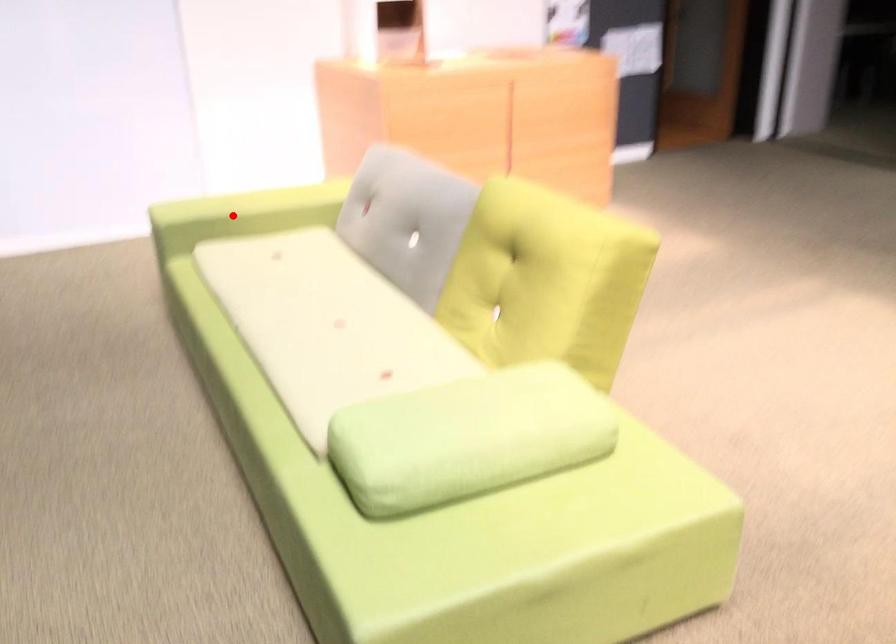
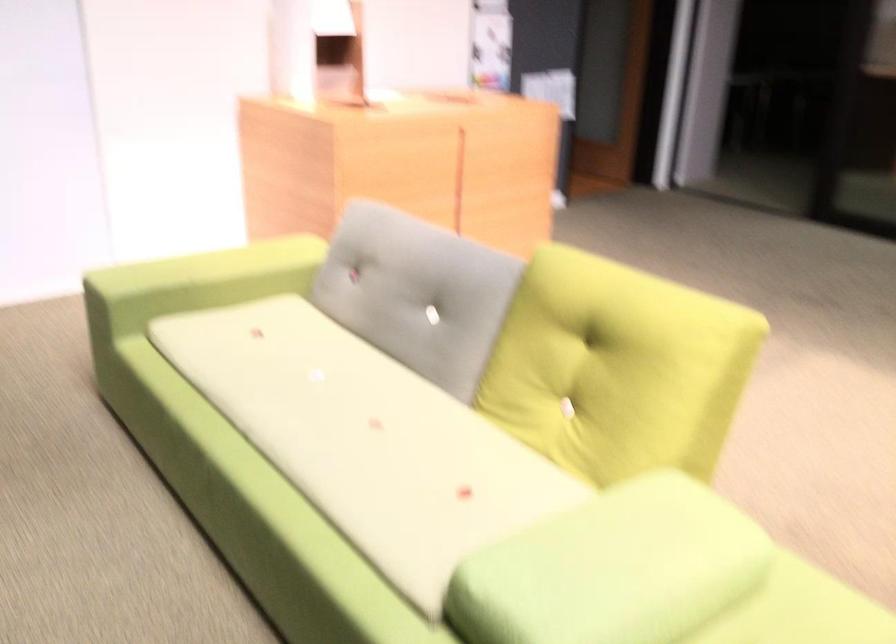
Find the pixel in the second image that matches the highlighted location in the first image.

(194, 283)